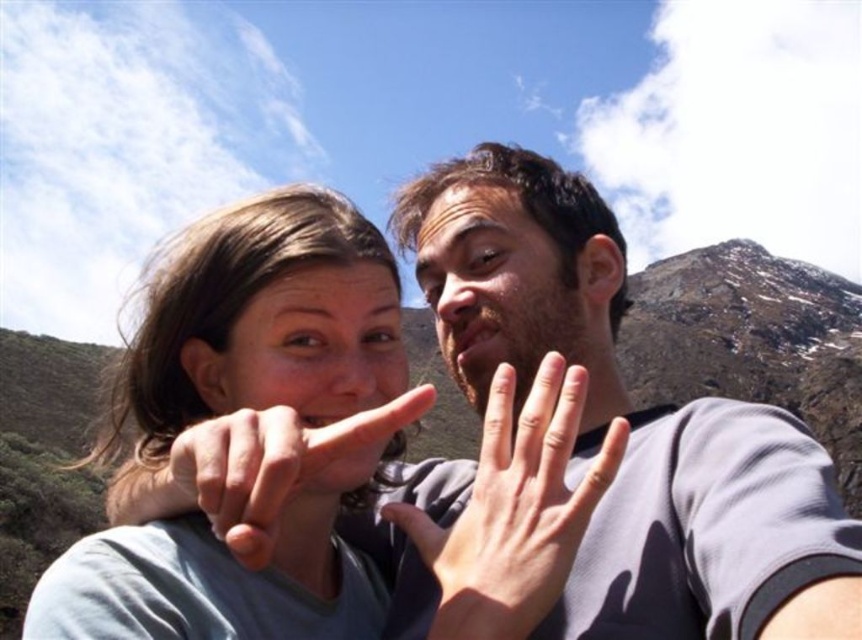
Which is above, matte gray shirt at center or smooth skin finger at center?

matte gray shirt at center

Which is in front, point (208, 630) or point (286, 481)?

Point (286, 481) is more forward.

The width and height of the screenshot is (862, 640). I want to click on matte gray shirt at center, so click(264, 321).

Which is in front, point (551, 444) or point (338, 403)?

Point (551, 444)

Can you confirm if smooth skin hand at center is positioned below matte skin face at center?

Indeed, smooth skin hand at center is positioned under matte skin face at center.

Which is behind, point (479, 563) or point (398, 392)?

The point (398, 392) is behind.

This screenshot has height=640, width=862. I want to click on smooth skin hand at center, so click(514, 509).

Who is more distant from viewer, (217, 388) or (372, 349)?

The point (372, 349) is behind.

Image resolution: width=862 pixels, height=640 pixels. Describe the element at coordinates (264, 321) in the screenshot. I see `matte gray shirt at center` at that location.

You are a GUI agent. You are given a task and a screenshot of the screen. Output one action in this format:
    pyautogui.click(x=<x>, y=<y>)
    Task: Click on the matte gray shirt at center
    Image resolution: width=862 pixels, height=640 pixels.
    Given the screenshot: What is the action you would take?
    pyautogui.click(x=264, y=321)